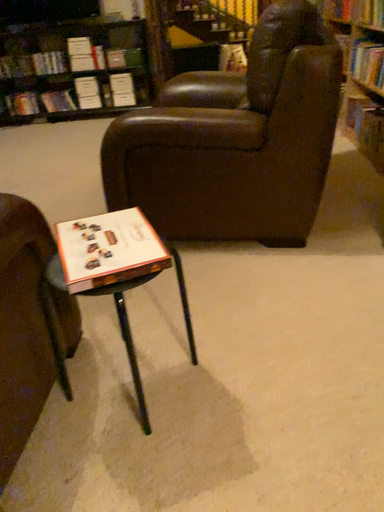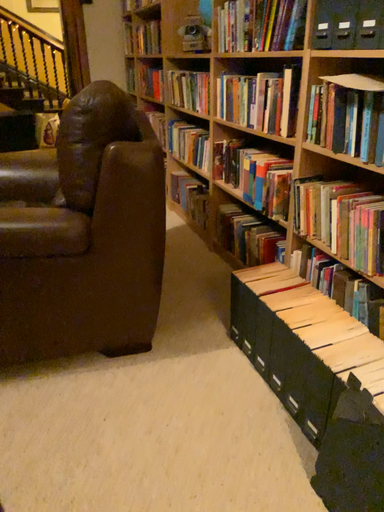
Question: Which way did the camera rotate in the video?

Choices:
 (A) rotated right
 (B) rotated left

Answer: (A)